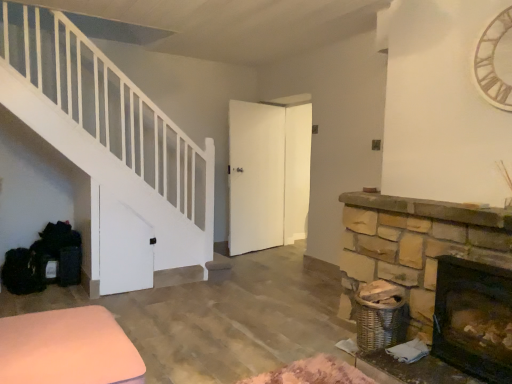
Question: From the image's perspective, is pink fabric ottoman at lower left below wooden clock at upper right?

Choices:
 (A) yes
 (B) no

Answer: (A)

Question: Is pink fabric ottoman at lower left completely or partially outside of wooden clock at upper right?

Choices:
 (A) no
 (B) yes

Answer: (B)

Question: From a real-world perspective, is pink fabric ottoman at lower left positioned over wooden clock at upper right based on gravity?

Choices:
 (A) yes
 (B) no

Answer: (B)

Question: Is pink fabric ottoman at lower left thinner than wooden clock at upper right?

Choices:
 (A) no
 (B) yes

Answer: (A)

Question: Considering the relative sizes of pink fabric ottoman at lower left and wooden clock at upper right in the image provided, is pink fabric ottoman at lower left shorter than wooden clock at upper right?

Choices:
 (A) yes
 (B) no

Answer: (A)

Question: From the image's perspective, is wooden clock at upper right positioned above or below dark brown stone fireplace at lower right?

Choices:
 (A) above
 (B) below

Answer: (A)

Question: Is wooden clock at upper right wider or thinner than dark brown stone fireplace at lower right?

Choices:
 (A) wide
 (B) thin

Answer: (B)

Question: Would you say wooden clock at upper right is inside or outside dark brown stone fireplace at lower right?

Choices:
 (A) inside
 (B) outside

Answer: (B)

Question: Is wooden clock at upper right taller or shorter than dark brown stone fireplace at lower right?

Choices:
 (A) tall
 (B) short

Answer: (A)

Question: Considering the positions of point (16, 359) and point (506, 62), is point (16, 359) closer or farther from the camera than point (506, 62)?

Choices:
 (A) farther
 (B) closer

Answer: (B)

Question: From the image's perspective, is pink fabric ottoman at lower left positioned above or below wooden clock at upper right?

Choices:
 (A) below
 (B) above

Answer: (A)

Question: From a real-world perspective, is pink fabric ottoman at lower left positioned above or below wooden clock at upper right?

Choices:
 (A) below
 (B) above

Answer: (A)

Question: In terms of size, does pink fabric ottoman at lower left appear bigger or smaller than wooden clock at upper right?

Choices:
 (A) big
 (B) small

Answer: (A)

Question: Relative to pink fabric ottoman at lower left, is dark brown stone fireplace at lower right in front or behind?

Choices:
 (A) behind
 (B) front

Answer: (A)

Question: From the image's perspective, is dark brown stone fireplace at lower right above or below pink fabric ottoman at lower left?

Choices:
 (A) above
 (B) below

Answer: (A)